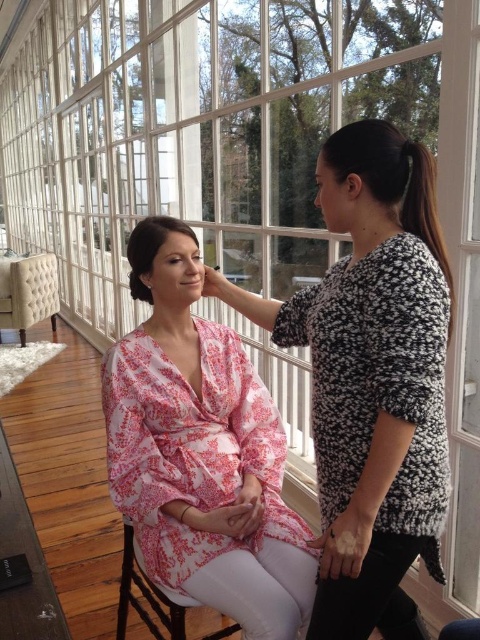
Does fluffy black sweater at upper right appear over dark brown silky hair at center?

No.

This screenshot has width=480, height=640. Identify the location of fluffy black sweater at upper right. (372, 378).

Is fluffy black sweater at upper right positioned behind tufted beige chair at left?

No, it is not.

How far apart are fluffy black sweater at upper right and tufted beige chair at left?

fluffy black sweater at upper right and tufted beige chair at left are 4.66 meters apart from each other.

Locate an element on the screen. fluffy black sweater at upper right is located at coordinates (372, 378).

This screenshot has width=480, height=640. In order to click on fluffy black sweater at upper right in this screenshot , I will do `click(372, 378)`.

Does fluffy black sweater at upper right appear on the right side of black textured hair at right?

No, fluffy black sweater at upper right is not to the right of black textured hair at right.

Which of these two, fluffy black sweater at upper right or black textured hair at right, stands shorter?

Standing shorter between the two is black textured hair at right.

At what (x,y) coordinates should I click in order to perform the action: click on fluffy black sweater at upper right. Please return your answer as a coordinate pair (x, y). Image resolution: width=480 pixels, height=640 pixels. Looking at the image, I should click on (372, 378).

Where is `fluffy black sweater at upper right`? The width and height of the screenshot is (480, 640). fluffy black sweater at upper right is located at coordinates (372, 378).